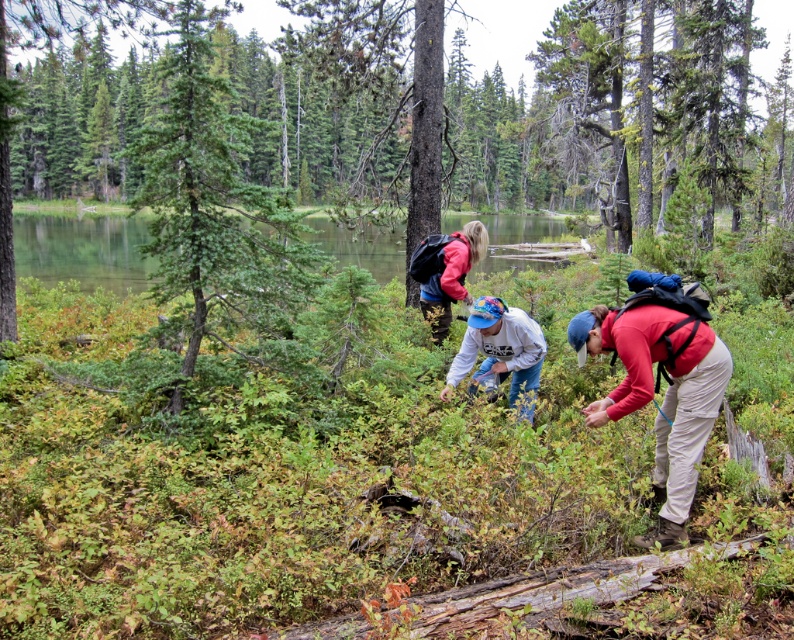
You are navigating through the forest and want to reach the point closer to you. Which of the two points, point (x=492, y=298) or point (x=461, y=244), should you head towards?

Point (x=492, y=298) is closer to the viewer, so you should head towards point (x=492, y=298).

You are a hiker who wants to find the tallest person in the group. You see the red matte jacket at lower right and the matte pink jacket at center. Which person is taller?

The red matte jacket at lower right is not as tall as the matte pink jacket at center, so the person in the matte pink jacket at center is taller.